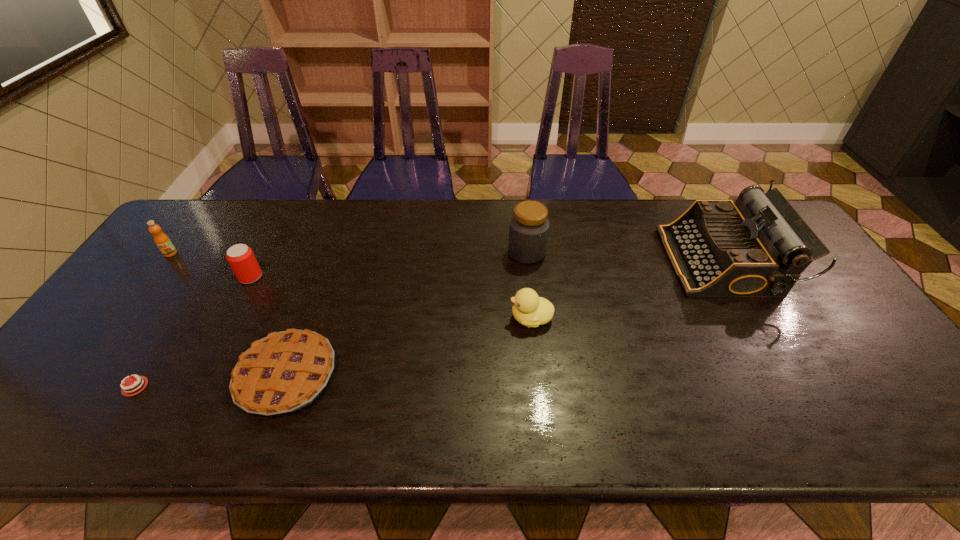
In order to click on free space located on the left of the pie in this screenshot , I will do `click(196, 377)`.

Find the location of a particular element. The width and height of the screenshot is (960, 540). vacant space situated on the left of the shortest object is located at coordinates (48, 387).

Identify the location of typewriter present at the far edge. The width and height of the screenshot is (960, 540). (758, 246).

The image size is (960, 540). Find the location of `jar at the far edge`. jar at the far edge is located at coordinates (529, 225).

At what (x,y) coordinates should I click in order to perform the action: click on pie located in the near edge section of the desktop. Please return your answer as a coordinate pair (x, y). This screenshot has width=960, height=540. Looking at the image, I should click on (285, 371).

Where is `chocolate cake situated at the near edge`? The height and width of the screenshot is (540, 960). chocolate cake situated at the near edge is located at coordinates [x=124, y=392].

Image resolution: width=960 pixels, height=540 pixels. In order to click on orange juice situated at the left edge in this screenshot , I will do `click(163, 242)`.

Where is `chocolate cake that is at the left edge`? chocolate cake that is at the left edge is located at coordinates (124, 392).

I want to click on object that is at the right edge, so point(758,246).

The width and height of the screenshot is (960, 540). What are the coordinates of `object situated at the near left corner` in the screenshot? It's located at (124, 392).